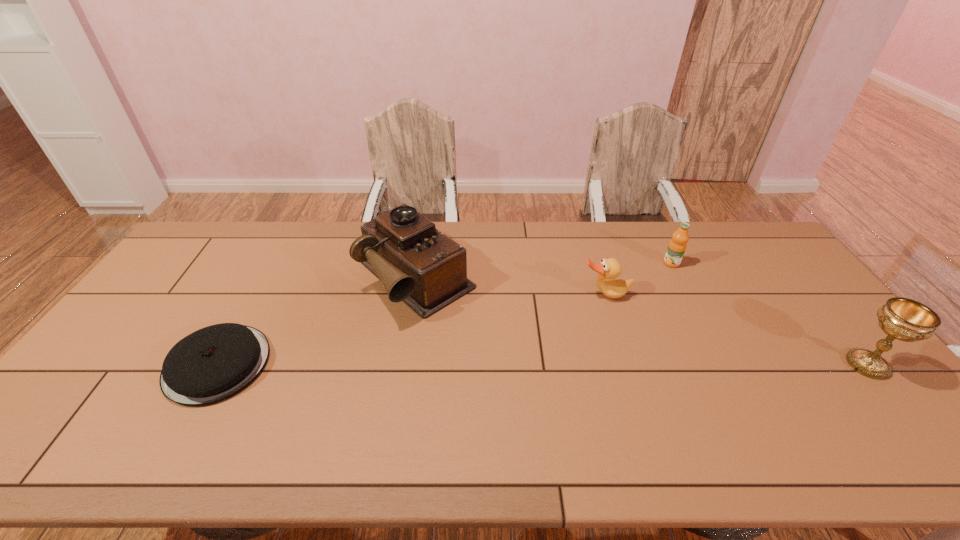
Where is `free space that satisfies the following two spatial constraints: 1. on the back side of the fourth object from left to right; 2. on the left side of the second object from left to right`? free space that satisfies the following two spatial constraints: 1. on the back side of the fourth object from left to right; 2. on the left side of the second object from left to right is located at coordinates (418, 264).